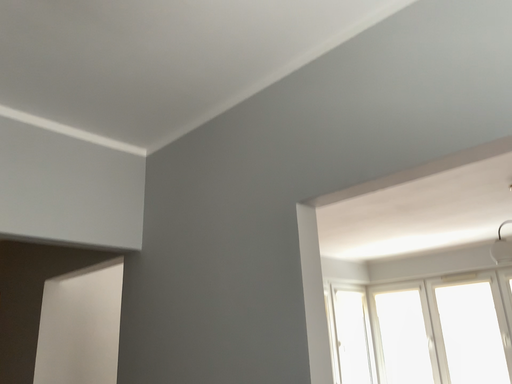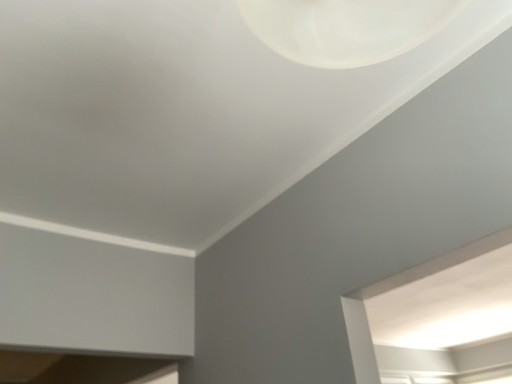
Question: Which way did the camera rotate in the video?

Choices:
 (A) rotated right
 (B) rotated left

Answer: (B)